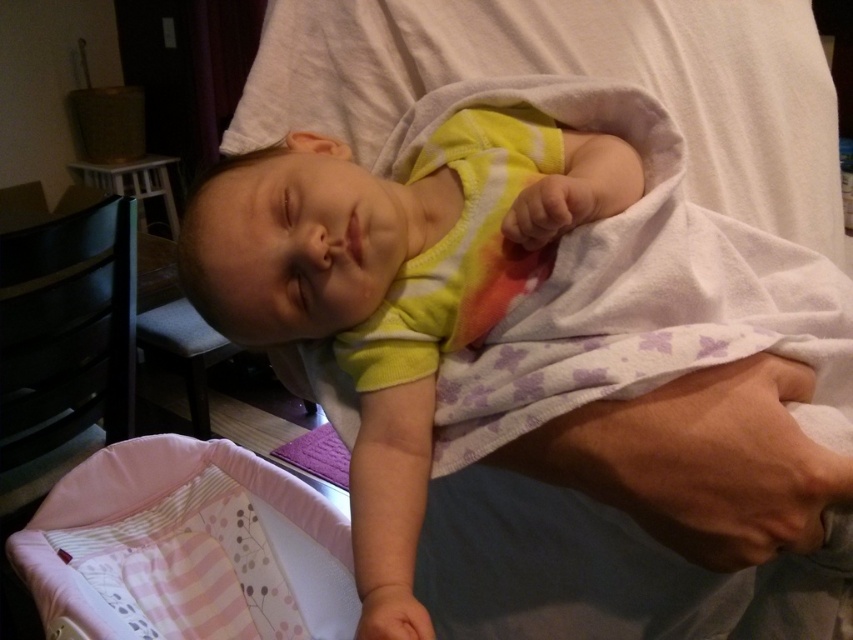
Can you confirm if yellow cotton onesie at center is positioned to the left of pink fabric infant bed at lower left?

In fact, yellow cotton onesie at center is to the right of pink fabric infant bed at lower left.

Can you confirm if yellow cotton onesie at center is shorter than pink fabric infant bed at lower left?

No, yellow cotton onesie at center is not shorter than pink fabric infant bed at lower left.

Is point (671, 584) positioned in front of point (135, 545)?

That is True.

The height and width of the screenshot is (640, 853). In order to click on yellow cotton onesie at center in this screenshot , I will do `click(633, 291)`.